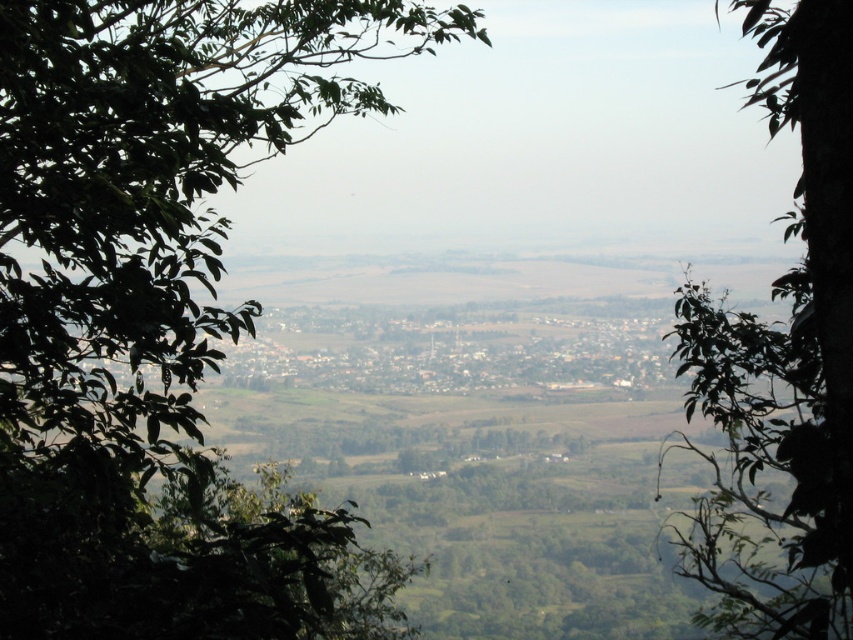
Can you confirm if green leafy tree at left is positioned above green leafy tree at center?

No.

Measure the distance between point (204, 161) and camera.

7.47 meters

This screenshot has width=853, height=640. What do you see at coordinates (161, 314) in the screenshot? I see `green leafy tree at left` at bounding box center [161, 314].

Identify the location of green leafy tree at left. (161, 314).